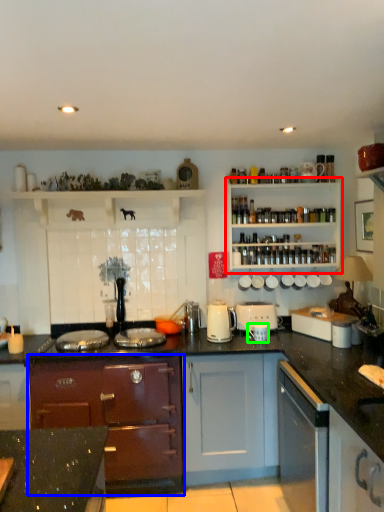
Question: Based on their relative distances, which object is farther from shelf (highlighted by a red box)? Choose from cabinetry (highlighted by a blue box) and appliance (highlighted by a green box).

Choices:
 (A) cabinetry
 (B) appliance

Answer: (A)